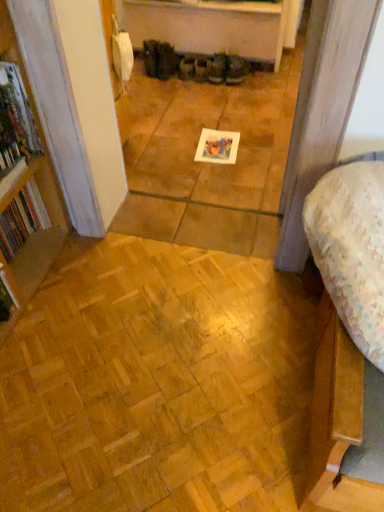
I want to click on vacant area in front of matte brown boot at center, so click(x=250, y=93).